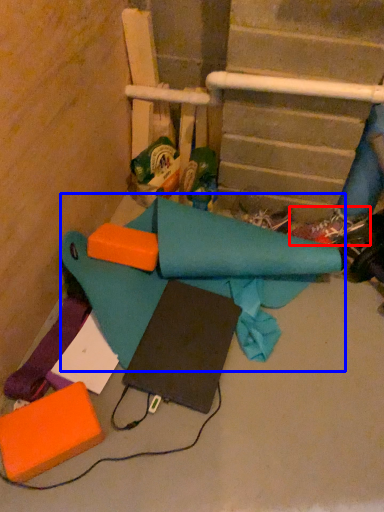
Question: Which point is closer to the camera, footwear (highlighted by a red box) or fabric (highlighted by a blue box)?

Choices:
 (A) footwear
 (B) fabric

Answer: (B)